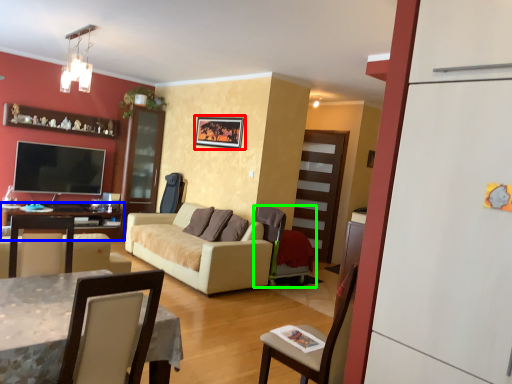
Question: Which object is positioned farthest from picture frame (highlighted by a red box)? Select from table (highlighted by a blue box) and chair (highlighted by a green box).

Choices:
 (A) table
 (B) chair

Answer: (A)